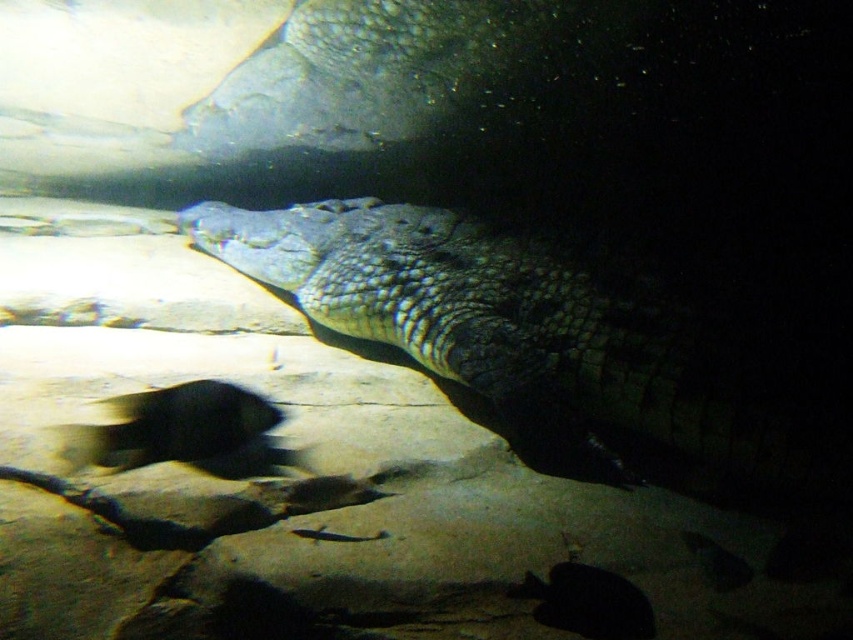
From the picture: You are a marine biologist observing the underwater scene. You notice a point labeled at coordinates (x=538, y=342). What does this point indicate?

The point at coordinates (x=538, y=342) indicates the scaly greenish brown crocodile at center.